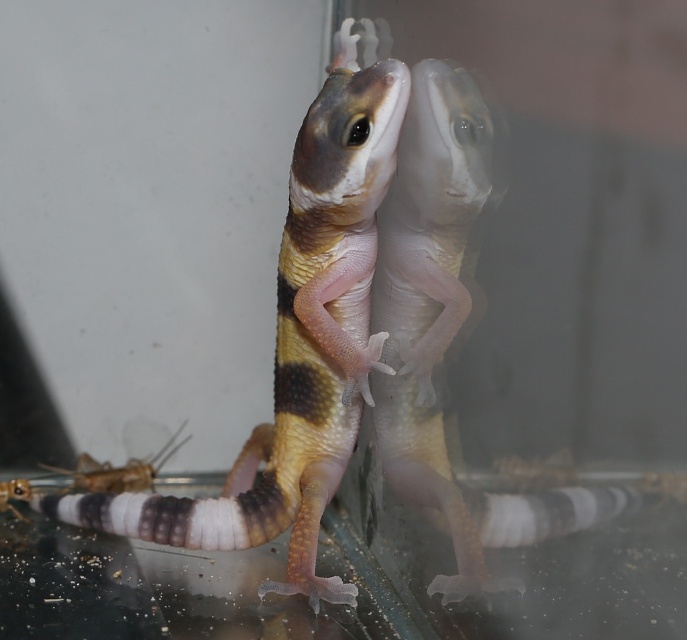
Can you confirm if multicolored scaly lizard at center is bigger than brown matte cricket at lower left?

Indeed, multicolored scaly lizard at center has a larger size compared to brown matte cricket at lower left.

Is multicolored scaly lizard at center thinner than brown matte cricket at lower left?

No.

Is point (297, 170) more distant than point (78, 476)?

No, it is in front of (78, 476).

What are the coordinates of `multicolored scaly lizard at center` in the screenshot? It's located at click(x=297, y=340).